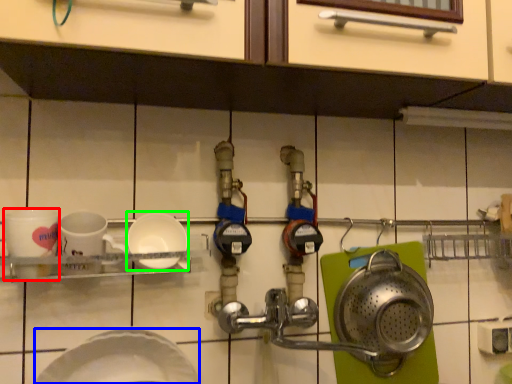
Question: Based on their relative distances, which object is farther from coffee cup (highlighted by a red box)? Choose from plate (highlighted by a blue box) and plate (highlighted by a green box).

Choices:
 (A) plate
 (B) plate

Answer: (A)